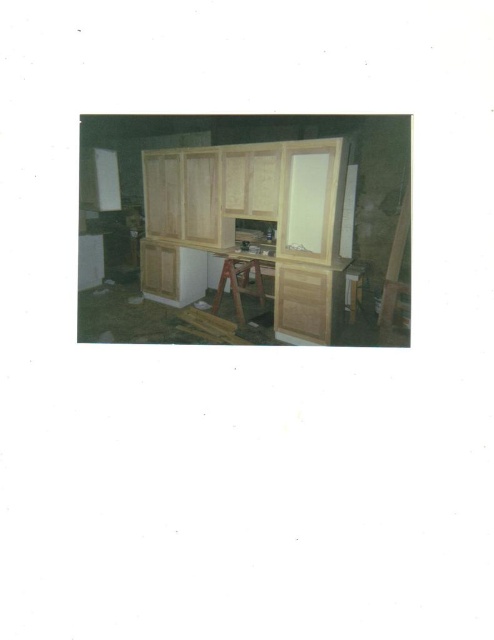
You are a worker in the workshop and need to move a heavy tool from the wooden ladder at right to the wooden stool at center. Which direction should you move the tool to place it on the stool?

The wooden ladder at right is to the right of the wooden stool at center, so you should move the tool to the left to place it on the wooden stool at center.

You are standing in the workshop and want to reach the point marked as point (x=408, y=220). Can you estimate how far you need to walk to get there?

The distance between you and point (x=408, y=220) is 19.98 feet, so you need to walk approximately 20 feet to reach it.